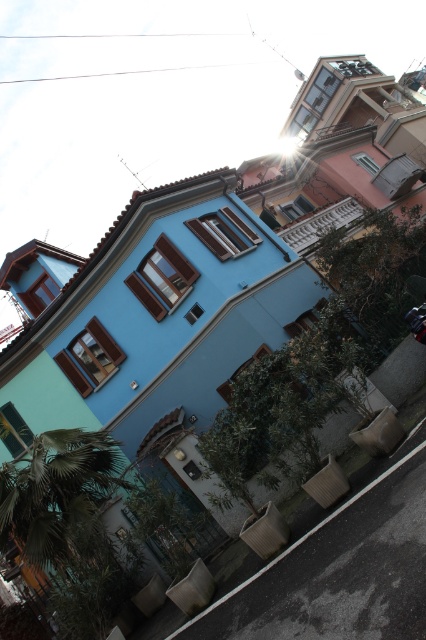
Which of these two, green leafy palm tree at lower left or shiny chrome motorcycle at center, stands shorter?

With less height is shiny chrome motorcycle at center.

Who is more distant from viewer, (63, 452) or (411, 317)?

The point (63, 452) is more distant.

The height and width of the screenshot is (640, 426). Identify the location of green leafy palm tree at lower left. (60, 499).